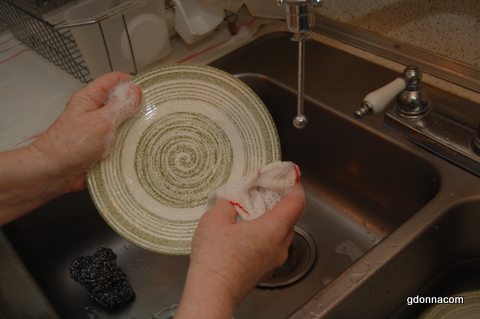
I want to click on plate, so click(x=164, y=168).